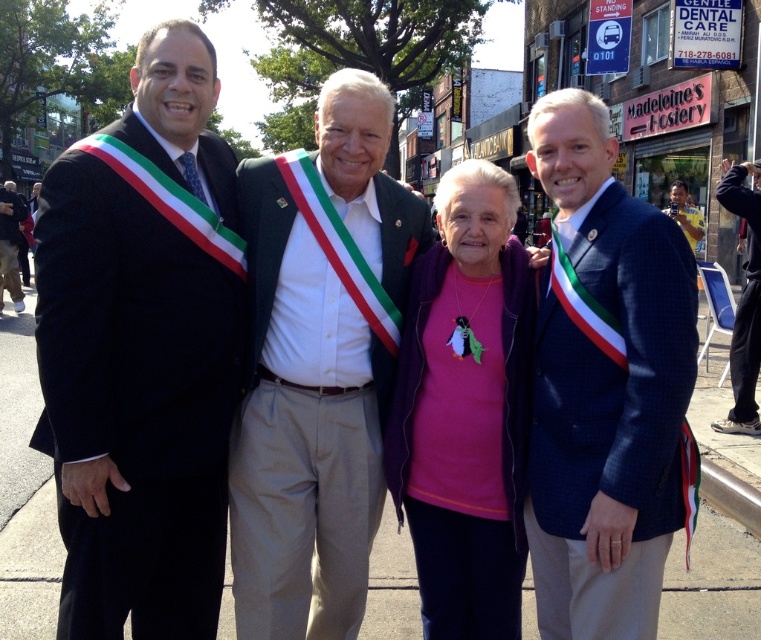
Between point (287, 314) and point (514, 474), which one is positioned in front?

Point (514, 474) is in front.

Can you confirm if white cotton shirt at center is positioned to the right of purple fabric at center?

Incorrect, white cotton shirt at center is not on the right side of purple fabric at center.

At what (x,y) coordinates should I click in order to perform the action: click on white cotton shirt at center. Please return your answer as a coordinate pair (x, y). The height and width of the screenshot is (640, 761). Looking at the image, I should click on (317, 369).

Based on the photo, can you confirm if matte black suit at left is positioned to the left of purple fabric at center?

Yes, matte black suit at left is to the left of purple fabric at center.

Between matte black suit at left and purple fabric at center, which one has less height?

Standing shorter between the two is purple fabric at center.

Is point (80, 516) behind point (502, 372)?

No, (80, 516) is closer to viewer.

You are a GUI agent. You are given a task and a screenshot of the screen. Output one action in this format:
    pyautogui.click(x=<x>, y=<y>)
    Task: Click on the matte black suit at left
    
    Given the screenshot: What is the action you would take?
    pyautogui.click(x=142, y=349)

Between purple fabric at center and black fabric pants at lower right, which one has less height?

purple fabric at center is shorter.

Measure the distance between point (482, 512) and camera.

Point (482, 512) and camera are 2.92 meters apart.

Find the location of a particular element. The width and height of the screenshot is (761, 640). purple fabric at center is located at coordinates (465, 410).